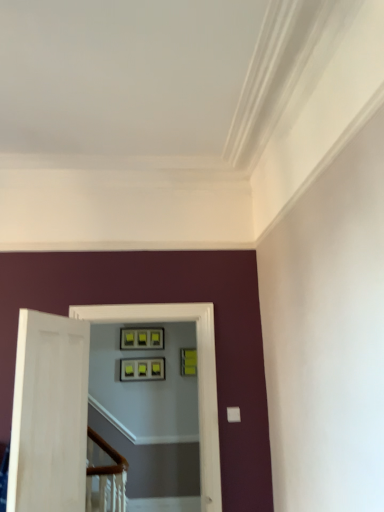
Question: Is green matte picture frame at upper center, which is the 2th picture frame from left to right, positioned behind matte black picture frame at center, which is the second picture frame from right to left?

Choices:
 (A) no
 (B) yes

Answer: (B)

Question: Is green matte picture frame at upper center, which is the 2th picture frame from left to right, surrounding matte black picture frame at center, which is the 1th picture frame in left-to-right order?

Choices:
 (A) no
 (B) yes

Answer: (A)

Question: Is green matte picture frame at upper center, which is the 2th picture frame from left to right, in contact with matte black picture frame at center, which is the 1th picture frame in left-to-right order?

Choices:
 (A) no
 (B) yes

Answer: (A)

Question: Does green matte picture frame at upper center, which is the 2th picture frame from left to right, have a lesser height compared to matte black picture frame at center, which is the 1th picture frame in left-to-right order?

Choices:
 (A) no
 (B) yes

Answer: (A)

Question: Is green matte picture frame at upper center, the 1th picture frame positioned from the right, at the left side of matte black picture frame at center, which is the 1th picture frame in left-to-right order?

Choices:
 (A) yes
 (B) no

Answer: (B)

Question: Can you confirm if green matte picture frame at upper center, the 1th picture frame positioned from the right, is positioned to the right of matte black picture frame at center, which is the second picture frame from right to left?

Choices:
 (A) yes
 (B) no

Answer: (A)

Question: Is green matte picture frame at upper center, which is the 2th picture frame from left to right, outside of matte black frames at center?

Choices:
 (A) no
 (B) yes

Answer: (B)

Question: Does green matte picture frame at upper center, the 1th picture frame positioned from the right, have a lesser height compared to matte black frames at center?

Choices:
 (A) yes
 (B) no

Answer: (A)

Question: From the image's perspective, would you say green matte picture frame at upper center, which is the 2th picture frame from left to right, is positioned over matte black frames at center?

Choices:
 (A) no
 (B) yes

Answer: (A)

Question: Is green matte picture frame at upper center, which is the 2th picture frame from left to right, taller than matte black frames at center?

Choices:
 (A) no
 (B) yes

Answer: (A)

Question: Considering the relative positions of green matte picture frame at upper center, the 1th picture frame positioned from the right, and matte black frames at center in the image provided, is green matte picture frame at upper center, the 1th picture frame positioned from the right, to the left of matte black frames at center from the viewer's perspective?

Choices:
 (A) no
 (B) yes

Answer: (A)

Question: Is the depth of green matte picture frame at upper center, which is the 2th picture frame from left to right, greater than that of matte black frames at center?

Choices:
 (A) yes
 (B) no

Answer: (A)

Question: Can you confirm if matte black picture frame at center, which is the second picture frame from right to left, is taller than green matte picture frame at upper center, which is the 2th picture frame from left to right?

Choices:
 (A) yes
 (B) no

Answer: (B)